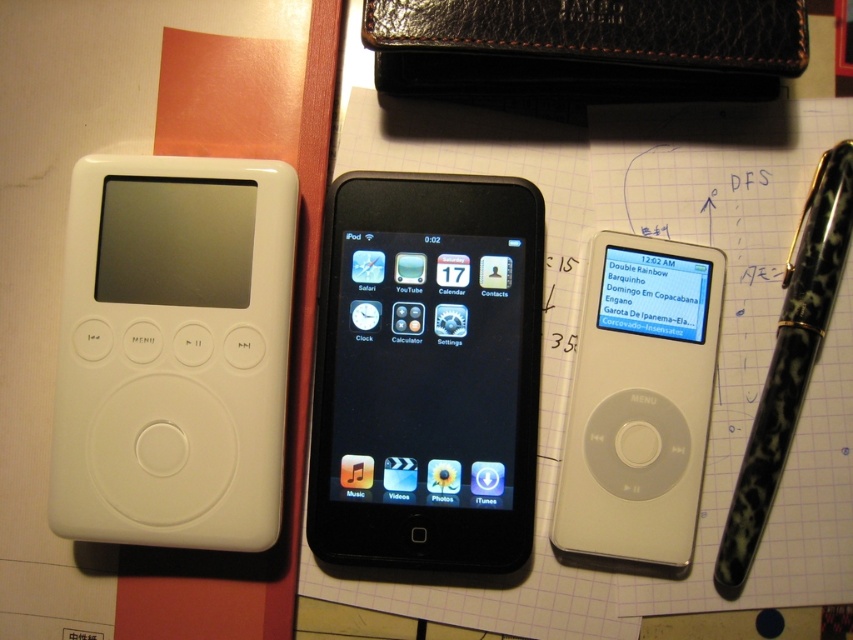
Question: Which of the following is the farthest from the observer?

Choices:
 (A) pyautogui.click(x=219, y=365)
 (B) pyautogui.click(x=833, y=272)
 (C) pyautogui.click(x=692, y=483)

Answer: (C)

Question: Where is white matte ipod at left located in relation to black marbled pen at right in the image?

Choices:
 (A) above
 (B) below

Answer: (A)

Question: Where is white matte ipod at left located in relation to black glossy tablet at center in the image?

Choices:
 (A) below
 (B) above

Answer: (B)

Question: Is white matte ipod at left thinner than black marbled pen at right?

Choices:
 (A) no
 (B) yes

Answer: (A)

Question: Which is nearer to the white matte ipod at left?

Choices:
 (A) white matte ipod at center
 (B) black marbled pen at right
 (C) black glossy tablet at center

Answer: (C)

Question: Which point appears farthest from the camera in this image?

Choices:
 (A) (714, 566)
 (B) (672, 324)
 (C) (437, 458)

Answer: (B)